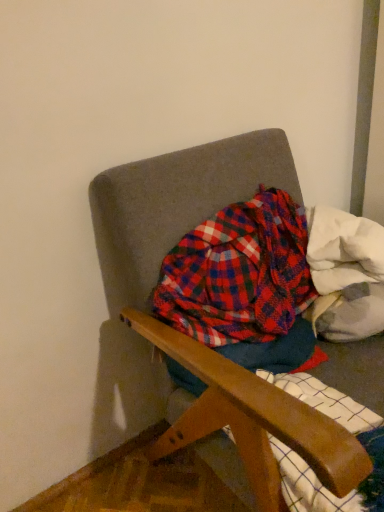
Question: Is plaid fabric at center far away from textured fabric chair at center?

Choices:
 (A) yes
 (B) no

Answer: (B)

Question: Considering the relative sizes of plaid fabric at center and textured fabric chair at center in the image provided, is plaid fabric at center taller than textured fabric chair at center?

Choices:
 (A) yes
 (B) no

Answer: (B)

Question: Could you tell me if plaid fabric at center is turned towards textured fabric chair at center?

Choices:
 (A) no
 (B) yes

Answer: (B)

Question: Is the depth of plaid fabric at center less than that of textured fabric chair at center?

Choices:
 (A) no
 (B) yes

Answer: (A)

Question: Can you confirm if plaid fabric at center is thinner than textured fabric chair at center?

Choices:
 (A) no
 (B) yes

Answer: (B)

Question: Is plaid fabric at center positioned behind textured fabric chair at center?

Choices:
 (A) yes
 (B) no

Answer: (A)

Question: Is textured fabric chair at center bigger than plaid fabric at center?

Choices:
 (A) no
 (B) yes

Answer: (B)

Question: Is textured fabric chair at center aimed at plaid fabric at center?

Choices:
 (A) no
 (B) yes

Answer: (B)

Question: Would you say textured fabric chair at center is outside plaid fabric at center?

Choices:
 (A) no
 (B) yes

Answer: (B)

Question: Is textured fabric chair at center next to plaid fabric at center and touching it?

Choices:
 (A) no
 (B) yes

Answer: (A)

Question: Is plaid fabric at center located within textured fabric chair at center?

Choices:
 (A) yes
 (B) no

Answer: (A)

Question: From the image's perspective, is textured fabric chair at center on top of plaid fabric at center?

Choices:
 (A) no
 (B) yes

Answer: (A)

Question: Considering the relative sizes of white fluffy blanket at upper right and plaid fabric at center in the image provided, is white fluffy blanket at upper right taller than plaid fabric at center?

Choices:
 (A) yes
 (B) no

Answer: (B)